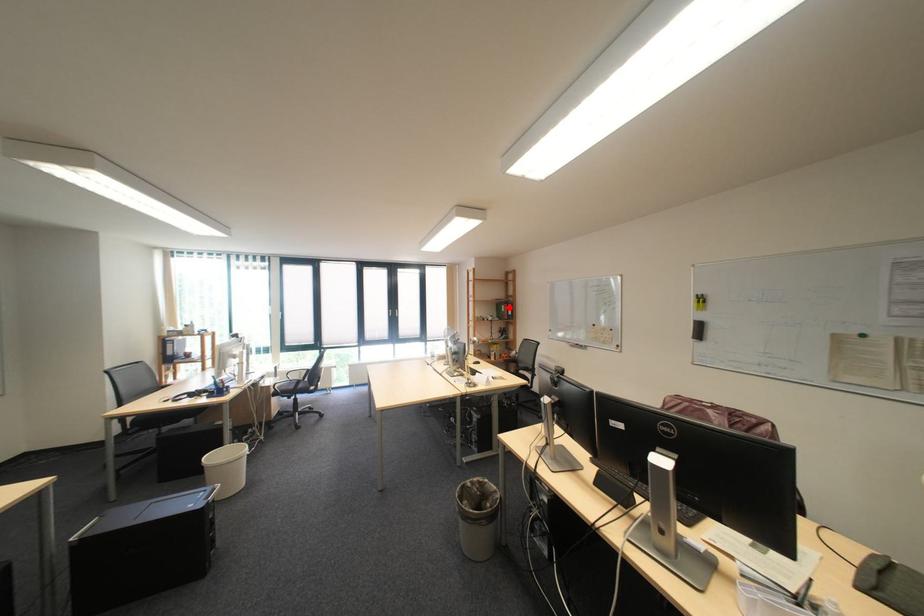
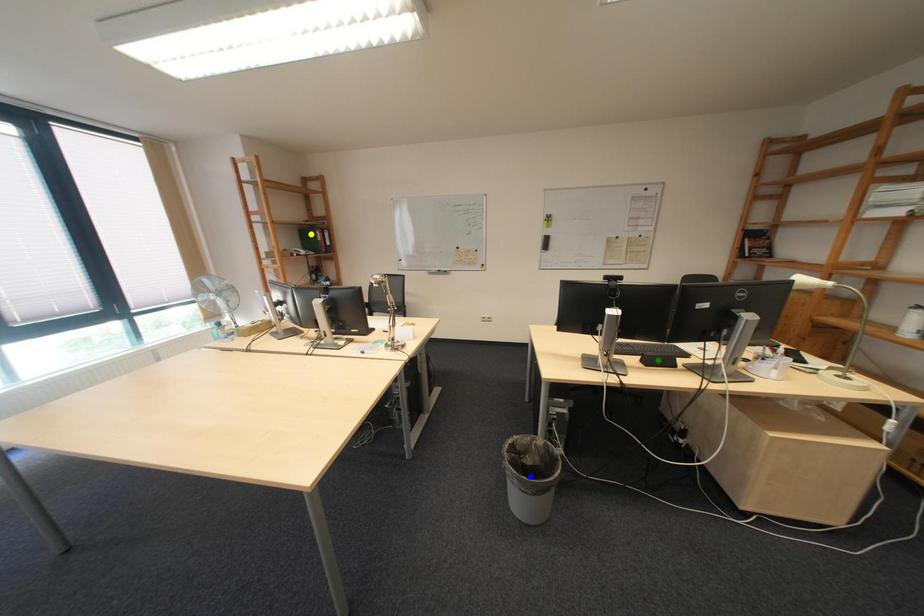
Question: I am providing you with two images of the same scene from different viewpoints. A red point is marked on the first image. You are given multiple points on the second image. Can you choose the point in image 2 that corresponds to the point in image 1?

Choices:
 (A) green point
 (B) yellow point
 (C) blue point

Answer: (B)